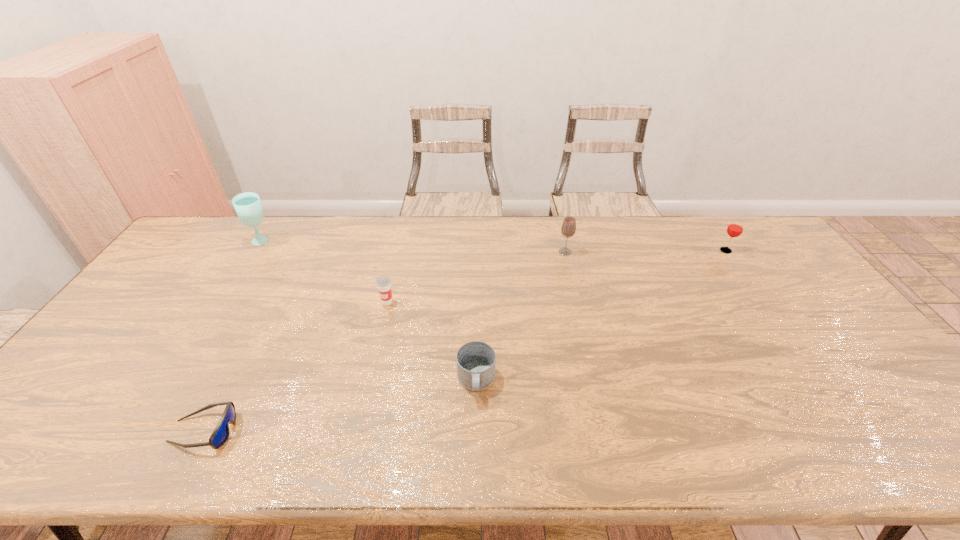
At what (x,y) coordinates should I click in order to perform the action: click on vacant point located 0.080m on the right of the leftmost object. Please return your answer as a coordinate pair (x, y). The width and height of the screenshot is (960, 540). Looking at the image, I should click on (297, 242).

Find the location of a particular element. vacant space located 0.250m on the right of the second object from right to left is located at coordinates [x=646, y=252].

I want to click on blank space located on the front of the rightmost glass, so click(x=745, y=278).

This screenshot has height=540, width=960. Find the location of `vacant space located 0.220m on the side of the third nearest object with the logo`. vacant space located 0.220m on the side of the third nearest object with the logo is located at coordinates (372, 368).

Where is `vacant space located 0.110m on the side of the second nearest object with the handle`? The image size is (960, 540). vacant space located 0.110m on the side of the second nearest object with the handle is located at coordinates (475, 447).

Image resolution: width=960 pixels, height=540 pixels. In order to click on vacant space located 0.230m on the front-facing side of the shortest object in this screenshot , I will do `click(337, 431)`.

The height and width of the screenshot is (540, 960). I want to click on object that is at the near edge, so click(x=220, y=434).

Find the location of a particular element. The height and width of the screenshot is (540, 960). free spot at the far edge of the desktop is located at coordinates (546, 246).

Find the location of a particular element. The height and width of the screenshot is (540, 960). free point at the near edge is located at coordinates (341, 449).

Identify the location of vacant area at the left edge of the desktop. The width and height of the screenshot is (960, 540). (80, 363).